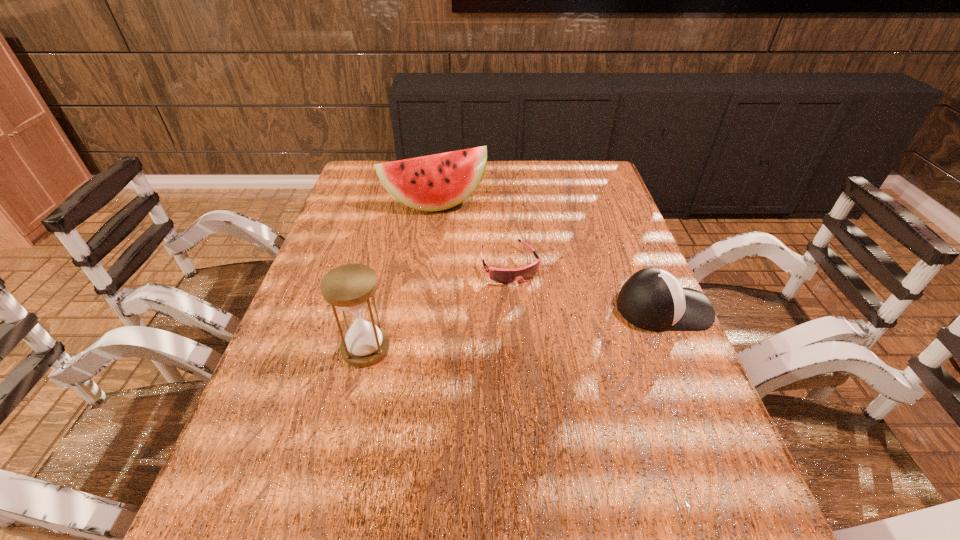
Where is `empty location between the rightmost object and the hourglass`? This screenshot has width=960, height=540. empty location between the rightmost object and the hourglass is located at coordinates (515, 328).

Identify the location of vacant space that is in between the rightmost object and the second farthest object. [587, 287].

Identify which object is located as the second nearest to the hourglass. Please provide its 2D coordinates. Your answer should be formatted as a tuple, i.e. [(x, y)], where the tuple contains the x and y coordinates of a point satisfying the conditions above.

[(437, 182)]

Identify which object is located as the second nearest to the hourglass. Please provide its 2D coordinates. Your answer should be formatted as a tuple, i.e. [(x, y)], where the tuple contains the x and y coordinates of a point satisfying the conditions above.

[(437, 182)]

Where is `free point that satisfies the following two spatial constraints: 1. on the back side of the hourglass; 2. on the left side of the goggles`? The image size is (960, 540). free point that satisfies the following two spatial constraints: 1. on the back side of the hourglass; 2. on the left side of the goggles is located at coordinates (386, 265).

Where is `vacant space that satisfies the following two spatial constraints: 1. on the back side of the third tallest object; 2. on the front panel of the hourglass`? The image size is (960, 540). vacant space that satisfies the following two spatial constraints: 1. on the back side of the third tallest object; 2. on the front panel of the hourglass is located at coordinates (375, 308).

The image size is (960, 540). I want to click on vacant region that satisfies the following two spatial constraints: 1. on the back side of the hourglass; 2. on the left side of the shortest object, so click(x=386, y=265).

I want to click on vacant area that satisfies the following two spatial constraints: 1. on the back side of the second shortest object; 2. on the front panel of the hourglass, so click(x=375, y=308).

Where is `vacant space that satisfies the following two spatial constraints: 1. on the back side of the hourglass; 2. on the front panel of the third tallest object`? The image size is (960, 540). vacant space that satisfies the following two spatial constraints: 1. on the back side of the hourglass; 2. on the front panel of the third tallest object is located at coordinates (375, 308).

Find the location of a particular element. The image size is (960, 540). vacant area that satisfies the following two spatial constraints: 1. on the front side of the cap; 2. on the front panel of the second farthest object is located at coordinates (513, 308).